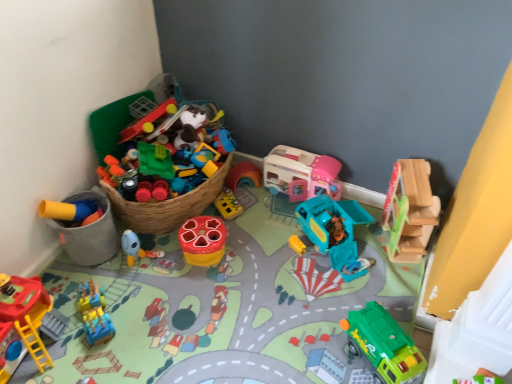
The width and height of the screenshot is (512, 384). Find the location of `vacant area that is in front of rubberized plastic toy at center, positioned as the fourth toy in left-to-right order`. vacant area that is in front of rubberized plastic toy at center, positioned as the fourth toy in left-to-right order is located at coordinates (201, 286).